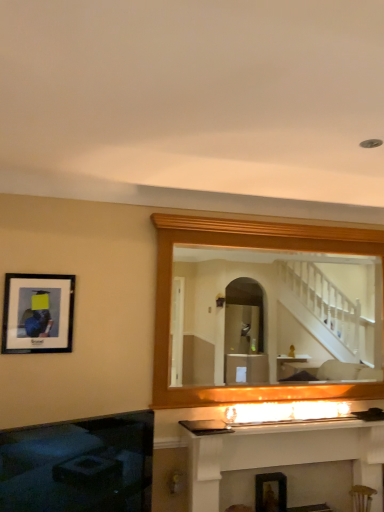
Question: Does matte black picture frame at left have a larger size compared to wooden mirror at upper center?

Choices:
 (A) yes
 (B) no

Answer: (B)

Question: Can you confirm if matte black picture frame at left is shorter than wooden mirror at upper center?

Choices:
 (A) no
 (B) yes

Answer: (B)

Question: From a real-world perspective, is matte black picture frame at left beneath wooden mirror at upper center?

Choices:
 (A) yes
 (B) no

Answer: (A)

Question: Is matte black picture frame at left located outside wooden mirror at upper center?

Choices:
 (A) no
 (B) yes

Answer: (B)

Question: From the image's perspective, is matte black picture frame at left beneath wooden mirror at upper center?

Choices:
 (A) no
 (B) yes

Answer: (A)

Question: Choose the correct answer: Is black glass fireplace at lower left, which ranks as the first fireplace in left-to-right order, inside wooden mirror at upper center or outside it?

Choices:
 (A) inside
 (B) outside

Answer: (B)

Question: Is point (142, 414) positioned closer to the camera than point (251, 380)?

Choices:
 (A) farther
 (B) closer

Answer: (B)

Question: From a real-world perspective, is black glass fireplace at lower left, which ranks as the first fireplace in left-to-right order, physically located above or below wooden mirror at upper center?

Choices:
 (A) above
 (B) below

Answer: (B)

Question: Is black glass fireplace at lower left, which ranks as the first fireplace in left-to-right order, bigger or smaller than wooden mirror at upper center?

Choices:
 (A) small
 (B) big

Answer: (A)

Question: Based on their positions, is black glass fireplace at lower left, the 2th fireplace viewed from the right, located to the left or right of matte black picture frame at left?

Choices:
 (A) left
 (B) right

Answer: (B)

Question: From the image's perspective, relative to matte black picture frame at left, is black glass fireplace at lower left, the 2th fireplace viewed from the right, above or below?

Choices:
 (A) above
 (B) below

Answer: (B)

Question: Is black glass fireplace at lower left, which ranks as the first fireplace in left-to-right order, inside the boundaries of matte black picture frame at left, or outside?

Choices:
 (A) outside
 (B) inside

Answer: (A)

Question: Considering the positions of black glass fireplace at lower left, the 2th fireplace viewed from the right, and matte black picture frame at left in the image, is black glass fireplace at lower left, the 2th fireplace viewed from the right, taller or shorter than matte black picture frame at left?

Choices:
 (A) short
 (B) tall

Answer: (B)

Question: Is white glossy fireplace at center, which is the second fireplace from left to right, taller or shorter than black glass fireplace at lower left, which ranks as the first fireplace in left-to-right order?

Choices:
 (A) tall
 (B) short

Answer: (A)

Question: Would you say white glossy fireplace at center, positioned as the first fireplace in right-to-left order, is inside or outside black glass fireplace at lower left, which ranks as the first fireplace in left-to-right order?

Choices:
 (A) inside
 (B) outside

Answer: (B)